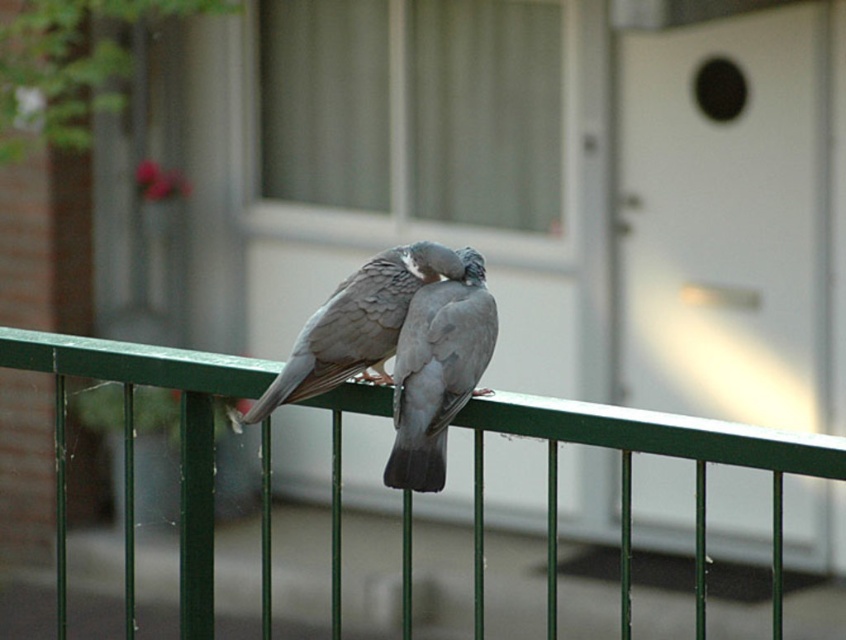
Question: Which point is farther from the camera taking this photo?

Choices:
 (A) (476, 291)
 (B) (548, 548)
 (C) (328, 380)

Answer: (A)

Question: Among these objects, which one is farthest from the camera?

Choices:
 (A) green metal fence at center
 (B) gray matte pigeon at center

Answer: (B)

Question: Can you confirm if gray matte pigeon at center is thinner than gray matte dove at center?

Choices:
 (A) yes
 (B) no

Answer: (A)

Question: Among these points, which one is farthest from the camera?

Choices:
 (A) (438, 394)
 (B) (199, 358)

Answer: (B)

Question: Does green metal fence at center have a larger size compared to gray matte pigeon at center?

Choices:
 (A) no
 (B) yes

Answer: (B)

Question: Is green metal fence at center smaller than gray matte pigeon at center?

Choices:
 (A) no
 (B) yes

Answer: (A)